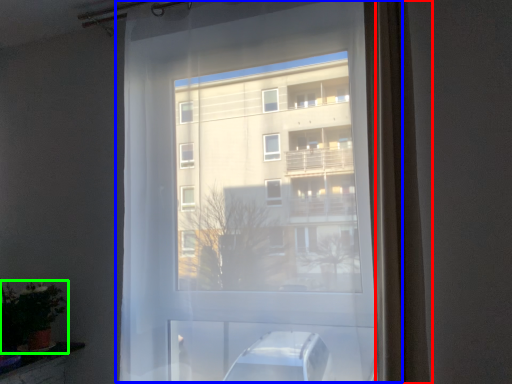
Question: Estimate the real-world distances between objects in this image. Which object is closer to curtain (highlighted by a red box), window (highlighted by a blue box) or houseplant (highlighted by a green box)?

Choices:
 (A) window
 (B) houseplant

Answer: (A)